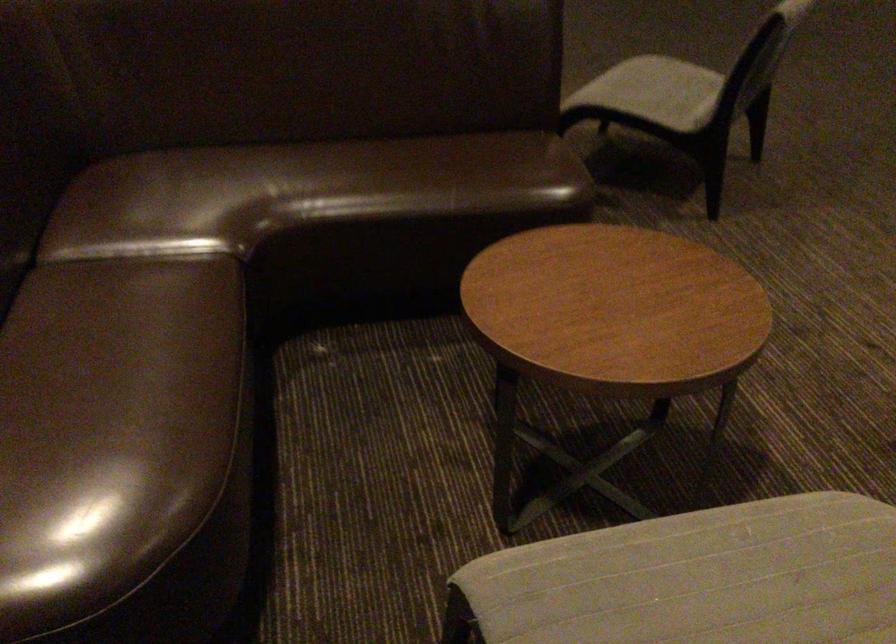
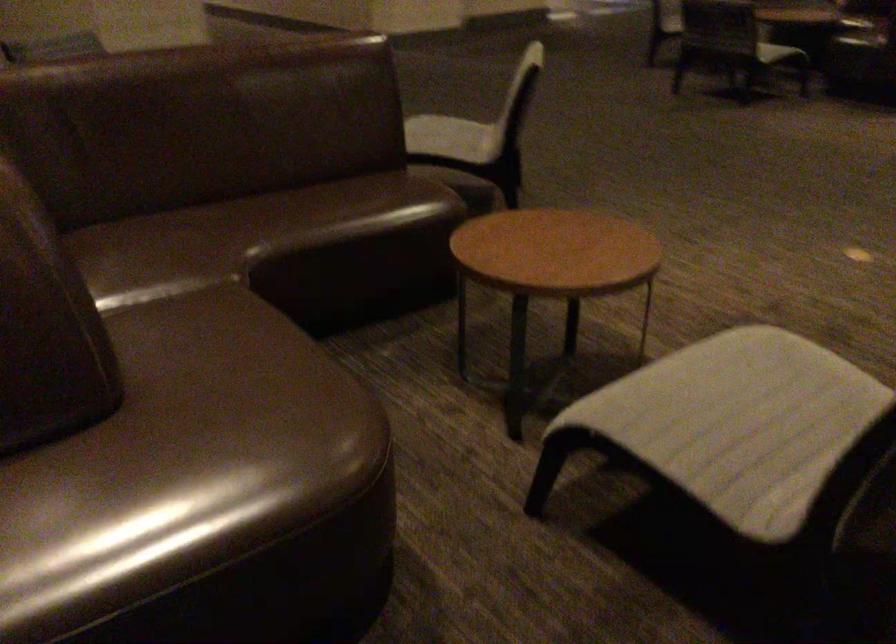
Question: How did the camera likely rotate?

Choices:
 (A) Left
 (B) Right
 (C) Up
 (D) Down

Answer: (B)